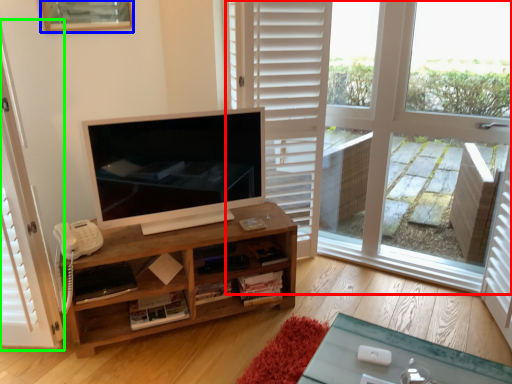
Question: Based on their relative distances, which object is nearer to window (highlighted by a red box)? Choose from picture frame (highlighted by a blue box) and screen door (highlighted by a green box).

Choices:
 (A) picture frame
 (B) screen door

Answer: (A)